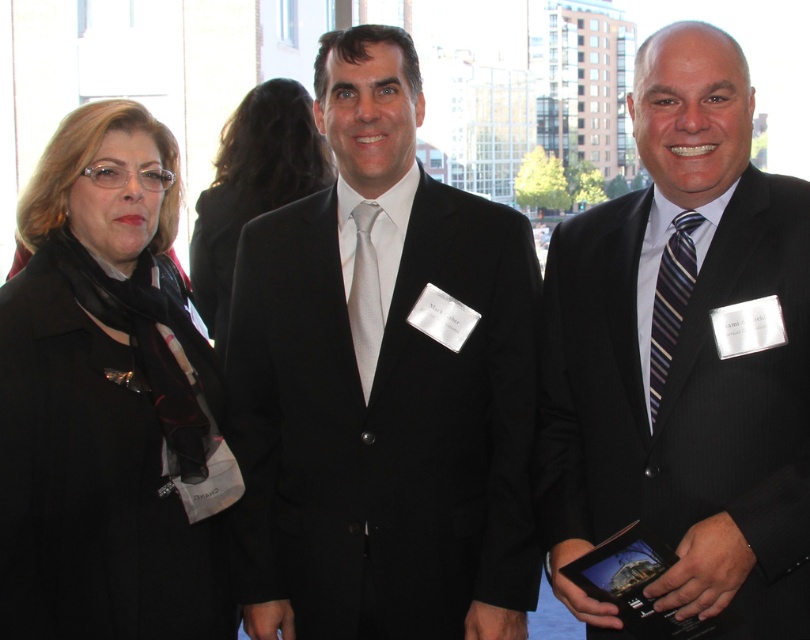
Who is taller, black wool coat at left or striped silk tie at right?

black wool coat at left is taller.

What do you see at coordinates (109, 401) in the screenshot?
I see `black wool coat at left` at bounding box center [109, 401].

Identify the location of black wool coat at left. (109, 401).

Can you confirm if matte black suit at center is positioned below striped silk tie at right?

Yes.

Between point (774, 188) and point (667, 260), which one is positioned in front?

Point (774, 188)

What do you see at coordinates (681, 356) in the screenshot?
I see `matte black suit at center` at bounding box center [681, 356].

Where is `matte black suit at center`? Image resolution: width=810 pixels, height=640 pixels. matte black suit at center is located at coordinates (681, 356).

Who is more distant from viewer, [437,580] or [212,307]?

Point [212,307]

Looking at this image, does black matte suit at center have a smaller size compared to matte black coat at center?

No.

Which is in front, point (521, 496) or point (229, 260)?

Point (521, 496)

You are a GUI agent. You are given a task and a screenshot of the screen. Output one action in this format:
    pyautogui.click(x=<x>, y=<y>)
    Task: Click on the black matte suit at center
    The image size is (810, 640).
    Given the screenshot: What is the action you would take?
    pyautogui.click(x=382, y=387)